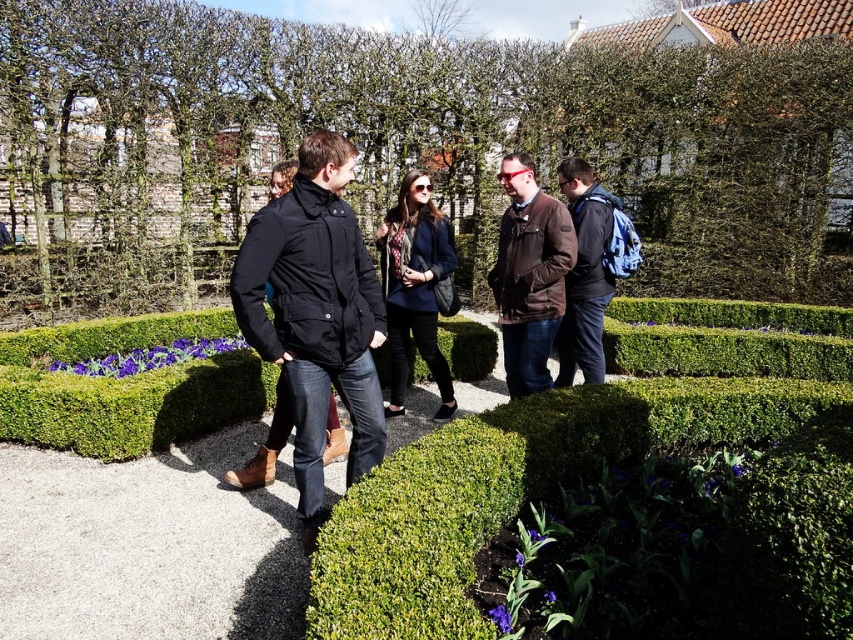
Question: Does black matte jacket at center come in front of blue backpack at center?

Choices:
 (A) no
 (B) yes

Answer: (B)

Question: Does black matte jacket at center appear on the right side of blue backpack at center?

Choices:
 (A) yes
 (B) no

Answer: (B)

Question: Which point appears farthest from the camera in this image?

Choices:
 (A) (433, 86)
 (B) (573, 218)
 (C) (339, 280)

Answer: (A)

Question: Which point is farther from the camera taking this photo?

Choices:
 (A) (556, 244)
 (B) (608, 237)

Answer: (B)

Question: Which object is the farthest from the matte black jacket at center?

Choices:
 (A) green leafy hedge at center
 (B) black matte jacket at center

Answer: (A)

Question: Can you confirm if green leafy hedge at center is smaller than brown leather jacket at center?

Choices:
 (A) yes
 (B) no

Answer: (B)